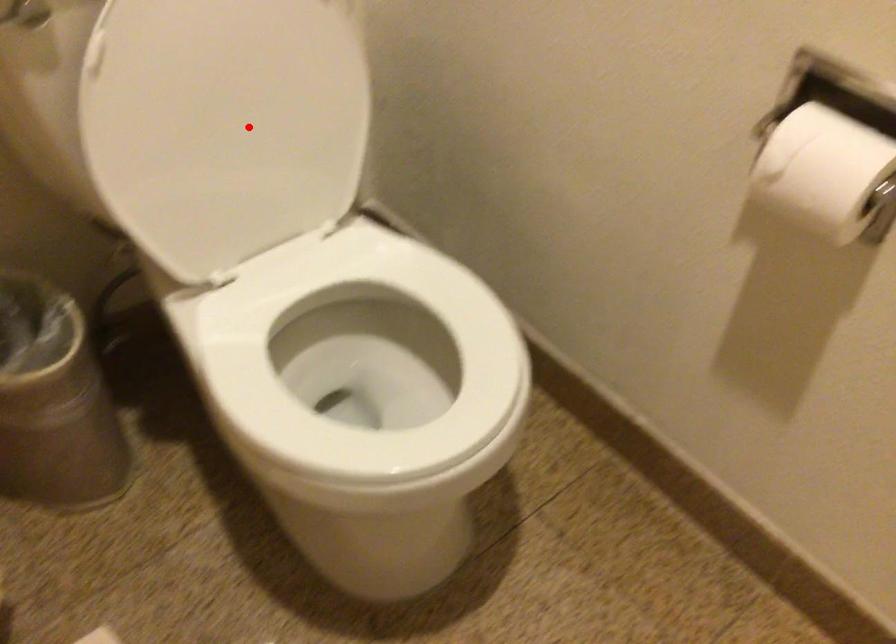
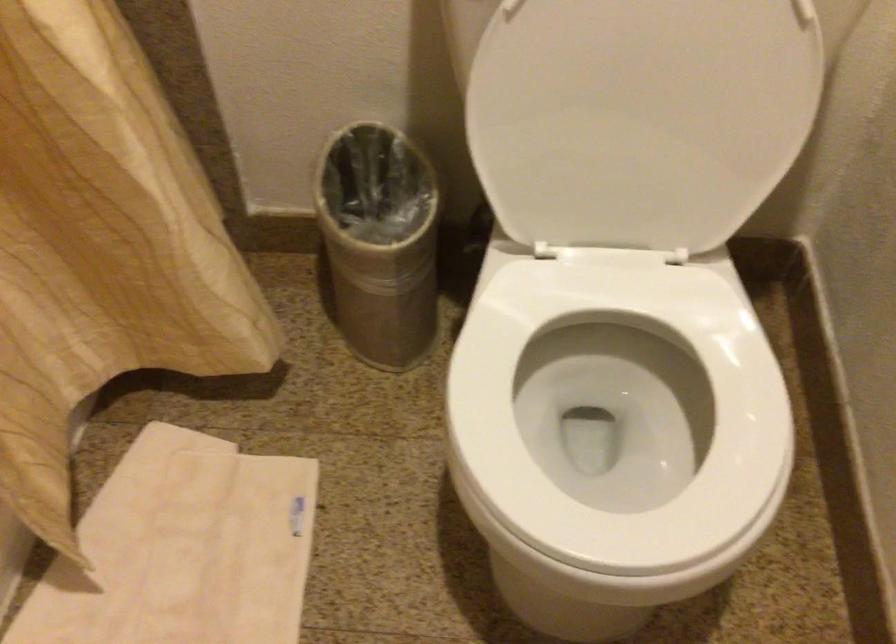
Where in the second image is the point corresponding to the highlighted location from the first image?

(640, 118)